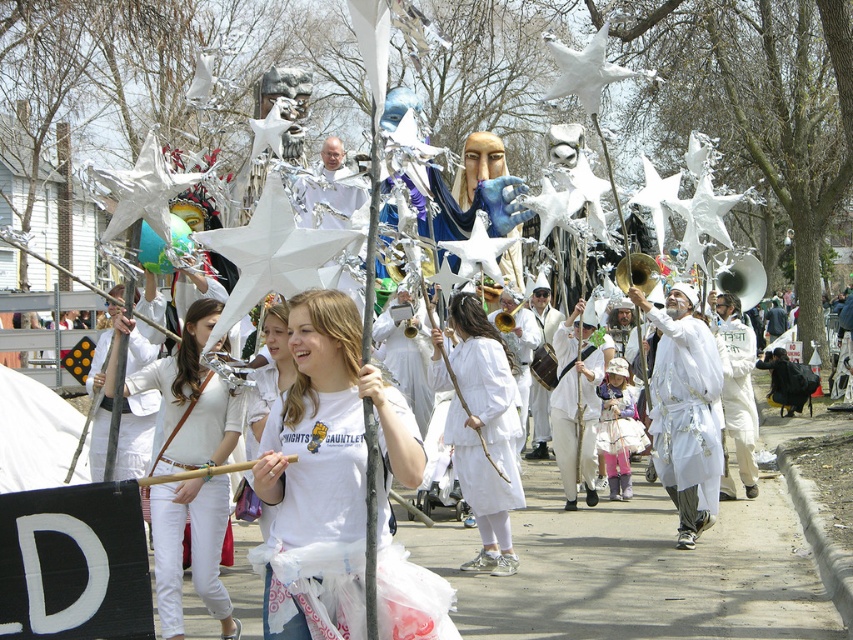
Question: Which point is farther to the camera?

Choices:
 (A) white paper star at upper center
 (B) white matte costume at center

Answer: (B)

Question: Is white matte t-shirt at center below white paper star at upper center?

Choices:
 (A) yes
 (B) no

Answer: (A)

Question: Does white matte costume at center appear on the right side of white matte mask at center?

Choices:
 (A) no
 (B) yes

Answer: (B)

Question: Can you confirm if white cotton shirt at center is smaller than white cotton dress at center?

Choices:
 (A) no
 (B) yes

Answer: (A)

Question: Which object is the farthest from the white matte dress at center?

Choices:
 (A) white matte t-shirt at center
 (B) white cotton shirt at center
 (C) white paper star at upper center
 (D) white matte costume at center

Answer: (A)

Question: Which object is farther from the camera taking this photo?

Choices:
 (A) white matte mask at center
 (B) white cotton shirt at center

Answer: (A)